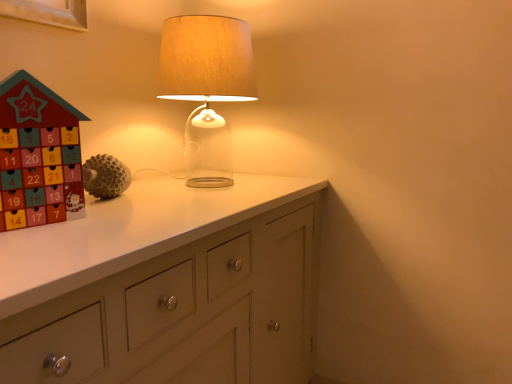
What do you see at coordinates (207, 87) in the screenshot?
I see `translucent glass lamp at center` at bounding box center [207, 87].

Locate an element on the screen. This screenshot has height=384, width=512. translucent glass lamp at center is located at coordinates (207, 87).

The height and width of the screenshot is (384, 512). Describe the element at coordinates (38, 155) in the screenshot. I see `wooden advent calendar at left` at that location.

Find the location of a particular element. This screenshot has height=384, width=512. wooden advent calendar at left is located at coordinates (38, 155).

What is the approximate height of wooden advent calendar at left?

The height of wooden advent calendar at left is 13.69 inches.

This screenshot has width=512, height=384. What are the coordinates of `translucent glass lamp at center` in the screenshot? It's located at (207, 87).

Considering the positions of objects wooden advent calendar at left and translucent glass lamp at center in the image provided, who is more to the right, wooden advent calendar at left or translucent glass lamp at center?

translucent glass lamp at center.

Is wooden advent calendar at left closer to camera compared to translucent glass lamp at center?

That is True.

Is point (29, 139) closer to camera compared to point (230, 82)?

Yes, point (29, 139) is in front of point (230, 82).

From the image's perspective, is wooden advent calendar at left located above or below translucent glass lamp at center?

From the image's perspective, wooden advent calendar at left appears below translucent glass lamp at center.

From a real-world perspective, between wooden advent calendar at left and translucent glass lamp at center, who is vertically lower?

From a 3D spatial view, wooden advent calendar at left is below.

Between wooden advent calendar at left and translucent glass lamp at center, which one has smaller width?

Thinner between the two is wooden advent calendar at left.

Is wooden advent calendar at left taller or shorter than translucent glass lamp at center?

Result: wooden advent calendar at left is shorter than translucent glass lamp at center.

Is wooden advent calendar at left bigger than translucent glass lamp at center?

No, wooden advent calendar at left is not bigger than translucent glass lamp at center.

Would you say translucent glass lamp at center is part of wooden advent calendar at left's contents?

That's incorrect, translucent glass lamp at center is not inside wooden advent calendar at left.

Is wooden advent calendar at left in contact with translucent glass lamp at center?

No.

Is wooden advent calendar at left oriented towards translucent glass lamp at center?

No, wooden advent calendar at left is not oriented towards translucent glass lamp at center.

Identify the location of toy below the translucent glass lamp at center (from the image's perspective). (38, 155).

Which object is positioned more to the right, translucent glass lamp at center or wooden advent calendar at left?

translucent glass lamp at center.

Who is more distant, translucent glass lamp at center or wooden advent calendar at left?

translucent glass lamp at center is behind.

Between point (219, 95) and point (61, 192), which one is positioned in front?

The point (61, 192) is more forward.

From the image's perspective, between translucent glass lamp at center and wooden advent calendar at left, which one is located above?

translucent glass lamp at center.

Looking at this image, from a real-world perspective, does translucent glass lamp at center sit lower than wooden advent calendar at left?

No.

Which of these two, translucent glass lamp at center or wooden advent calendar at left, is thinner?

wooden advent calendar at left is thinner.

Between translucent glass lamp at center and wooden advent calendar at left, which one has more height?

With more height is translucent glass lamp at center.

Considering the sizes of objects translucent glass lamp at center and wooden advent calendar at left in the image provided, who is bigger, translucent glass lamp at center or wooden advent calendar at left?

With larger size is translucent glass lamp at center.

Would you say translucent glass lamp at center is outside wooden advent calendar at left?

Yes, translucent glass lamp at center is not within wooden advent calendar at left.

Is translucent glass lamp at center far from wooden advent calendar at left?

No, translucent glass lamp at center is in close proximity to wooden advent calendar at left.

Does translucent glass lamp at center turn towards wooden advent calendar at left?

No.

Measure the distance from translucent glass lamp at center to wooden advent calendar at left.

translucent glass lamp at center is 23.03 inches away from wooden advent calendar at left.

Find the location of a particular element. The width and height of the screenshot is (512, 384). toy below the translucent glass lamp at center (from the image's perspective) is located at coordinates (38, 155).

Find the location of a particular element. Image resolution: width=512 pixels, height=384 pixels. toy below the translucent glass lamp at center (from the image's perspective) is located at coordinates (38, 155).

Where is `lamp behind the wooden advent calendar at left`? Image resolution: width=512 pixels, height=384 pixels. lamp behind the wooden advent calendar at left is located at coordinates 207,87.